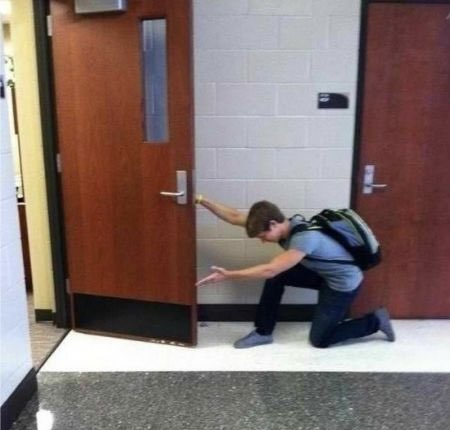
Image resolution: width=450 pixels, height=430 pixels. I want to click on dark part of floor, so click(x=289, y=396).